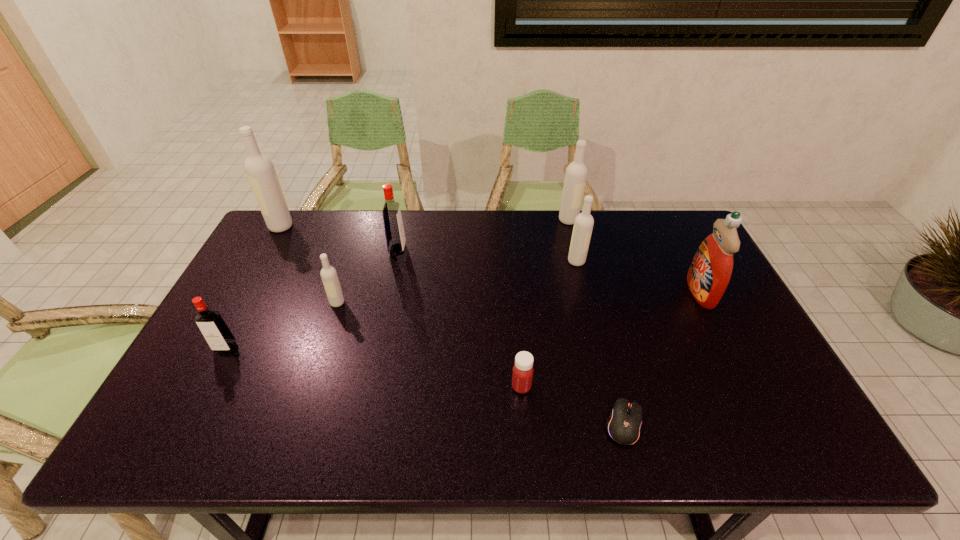
You are a GUI agent. You are given a task and a screenshot of the screen. Output one action in this format:
    pyautogui.click(x=<x>, y=<y>)
    Task: Click on the vacant space located 0.190m on the front surface of the rightmost object
    The height and width of the screenshot is (540, 960).
    Given the screenshot: What is the action you would take?
    pyautogui.click(x=624, y=292)

The height and width of the screenshot is (540, 960). In order to click on vacant position located 0.240m on the back of the second nearest white vodka in this screenshot , I will do `click(564, 213)`.

This screenshot has width=960, height=540. Find the location of `vacant space located on the front and back of the bigger red vodka`. vacant space located on the front and back of the bigger red vodka is located at coordinates (527, 249).

The width and height of the screenshot is (960, 540). I want to click on vacant region located 0.140m on the back of the smallest white vodka, so click(x=349, y=266).

At what (x,y) coordinates should I click in order to perform the action: click on vacant area situated 0.260m on the front and back of the left red vodka. Please return your answer as a coordinate pair (x, y). Looking at the image, I should click on (171, 451).

Locate an element on the screen. vacant area located 0.330m on the right of the red medicine is located at coordinates (667, 387).

I want to click on vacant region located on the left of the shortest object, so click(x=534, y=424).

Image resolution: width=960 pixels, height=540 pixels. In order to click on object located at the near edge in this screenshot , I will do `click(624, 424)`.

You are a GUI agent. You are given a task and a screenshot of the screen. Output one action in this format:
    pyautogui.click(x=<x>, y=<y>)
    Task: Click on the object present at the right edge
    This screenshot has height=540, width=960.
    Given the screenshot: What is the action you would take?
    pyautogui.click(x=709, y=274)

Where is `object located in the far left corner section of the desktop`? This screenshot has height=540, width=960. object located in the far left corner section of the desktop is located at coordinates (260, 170).